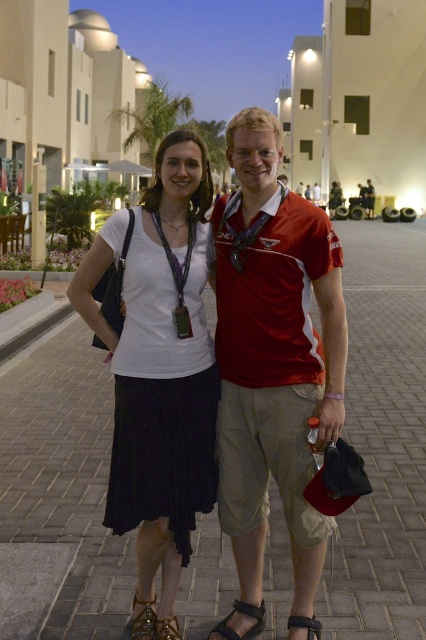
Is white matte skirt at center to the right of leather sandal at lower center from the viewer's perspective?

In fact, white matte skirt at center is to the left of leather sandal at lower center.

Does white matte skirt at center lie in front of leather sandal at lower center?

No, it is behind leather sandal at lower center.

Where is `white matte skirt at center`? This screenshot has height=640, width=426. white matte skirt at center is located at coordinates (160, 364).

Consider the image. Between brown leather sandal at lower center and black leather sandal at lower center, which one appears on the right side from the viewer's perspective?

black leather sandal at lower center

Locate an element on the screen. brown leather sandal at lower center is located at coordinates (244, 614).

Can you confirm if red fabric shirt at center is positioned below white matte skirt at center?

Actually, red fabric shirt at center is above white matte skirt at center.

Between point (316, 369) and point (180, 324), which one is positioned behind?

Positioned behind is point (180, 324).

Where is `red fabric shirt at center`? red fabric shirt at center is located at coordinates (273, 355).